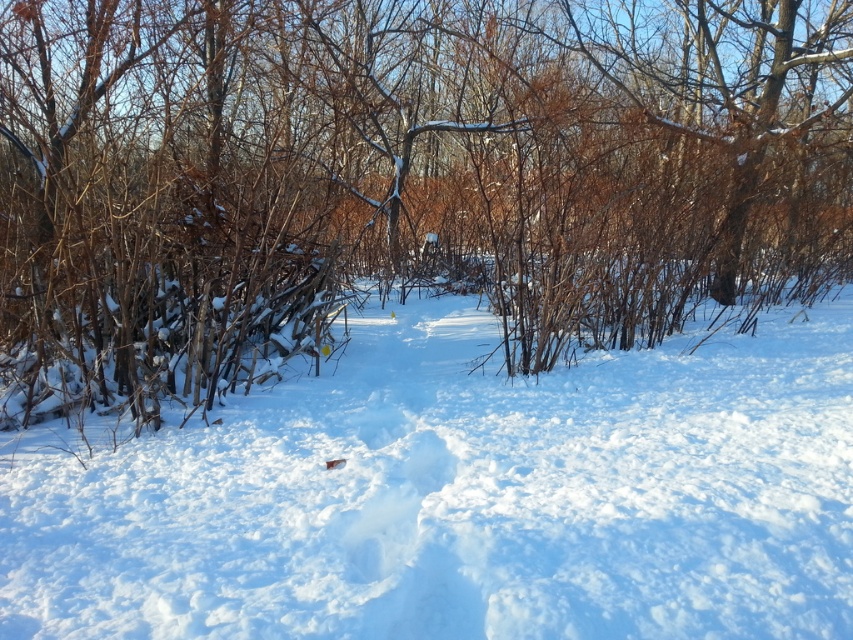
Does brown wood at center have a lesser height compared to white fluffy snow at center?

In fact, brown wood at center may be taller than white fluffy snow at center.

Can you confirm if brown wood at center is wider than white fluffy snow at center?

Correct, the width of brown wood at center exceeds that of white fluffy snow at center.

Who is more distant from viewer, (108, 344) or (94, 540)?

The point (108, 344) is more distant.

Find the location of a particular element. This screenshot has height=640, width=853. brown wood at center is located at coordinates (399, 177).